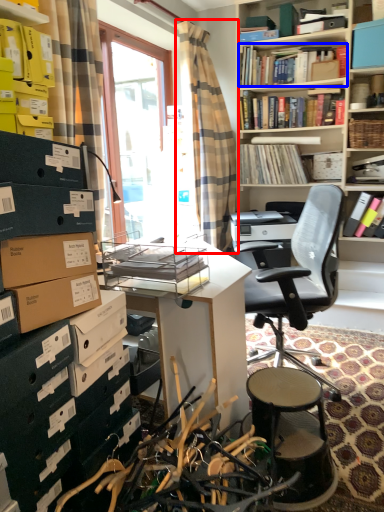
Question: Among these objects, which one is nearest to the camera, curtain (highlighted by a red box) or book (highlighted by a blue box)?

Choices:
 (A) curtain
 (B) book

Answer: (A)